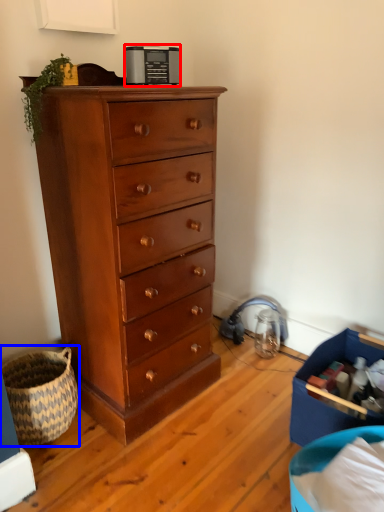
Question: Which of the following is the farthest to the observer, appliance (highlighted by a red box) or basket (highlighted by a blue box)?

Choices:
 (A) appliance
 (B) basket

Answer: (A)